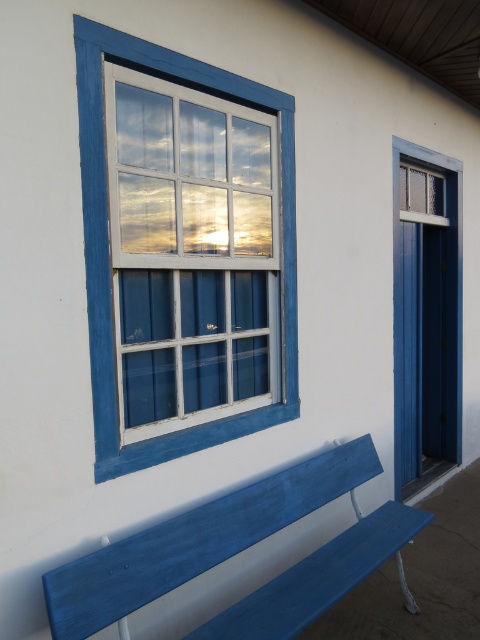
Question: Which point appears farthest from the camera in this image?

Choices:
 (A) (423, 376)
 (B) (285, 305)
 (C) (336, 460)

Answer: (A)

Question: Considering the real-world distances, which object is closest to the blue painted wood door at right?

Choices:
 (A) matte blue bench at lower center
 (B) blue painted wood window at upper left

Answer: (A)

Question: Can you confirm if matte blue bench at lower center is bigger than blue painted wood window at upper left?

Choices:
 (A) yes
 (B) no

Answer: (A)

Question: Which of the following is the farthest from the observer?

Choices:
 (A) matte blue bench at lower center
 (B) blue painted wood window at upper left

Answer: (B)

Question: Can you confirm if matte blue bench at lower center is positioned below blue painted wood window at upper left?

Choices:
 (A) no
 (B) yes

Answer: (B)

Question: Can you confirm if blue painted wood window at upper left is positioned below blue painted wood door at right?

Choices:
 (A) yes
 (B) no

Answer: (B)